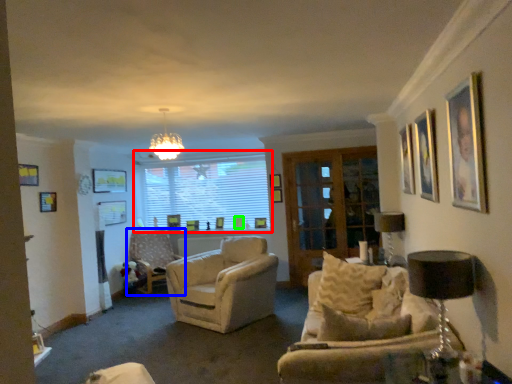
Question: Which object is positioned closest to window (highlighted by a red box)? Select from chair (highlighted by a blue box) and picture frame (highlighted by a green box).

Choices:
 (A) chair
 (B) picture frame

Answer: (B)